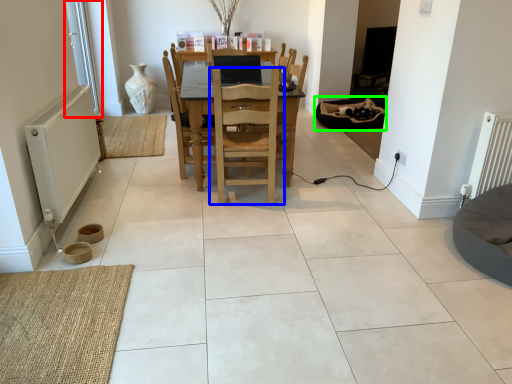
Question: Based on their relative distances, which object is nearer to window screen (highlighted by a red box)? Choose from chair (highlighted by a blue box) and bean bag chair (highlighted by a green box).

Choices:
 (A) chair
 (B) bean bag chair

Answer: (A)